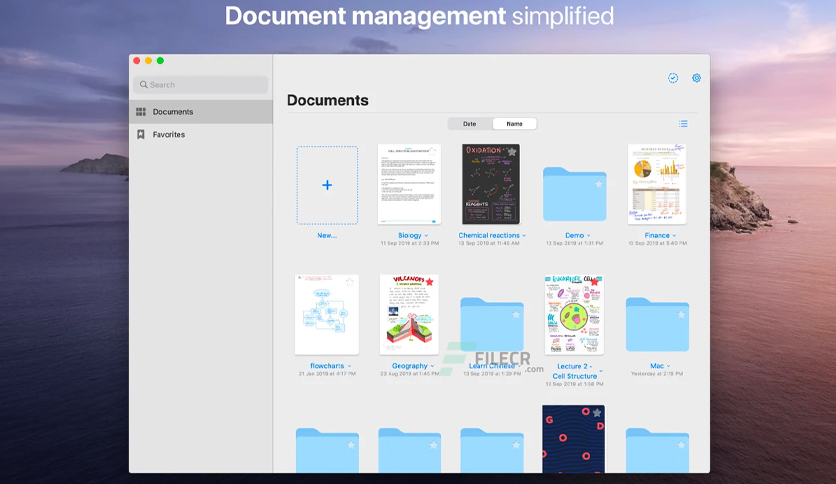
Locate an element on the screen. documents is located at coordinates (329, 314), (395, 314), (411, 203), (475, 202), (562, 303), (645, 195).